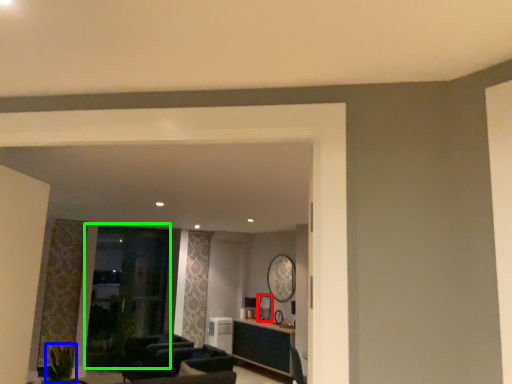
Question: Which object is positioned farthest from picture frame (highlighted by a red box)? Select from plant (highlighted by a blue box) and glass door (highlighted by a green box).

Choices:
 (A) plant
 (B) glass door

Answer: (A)